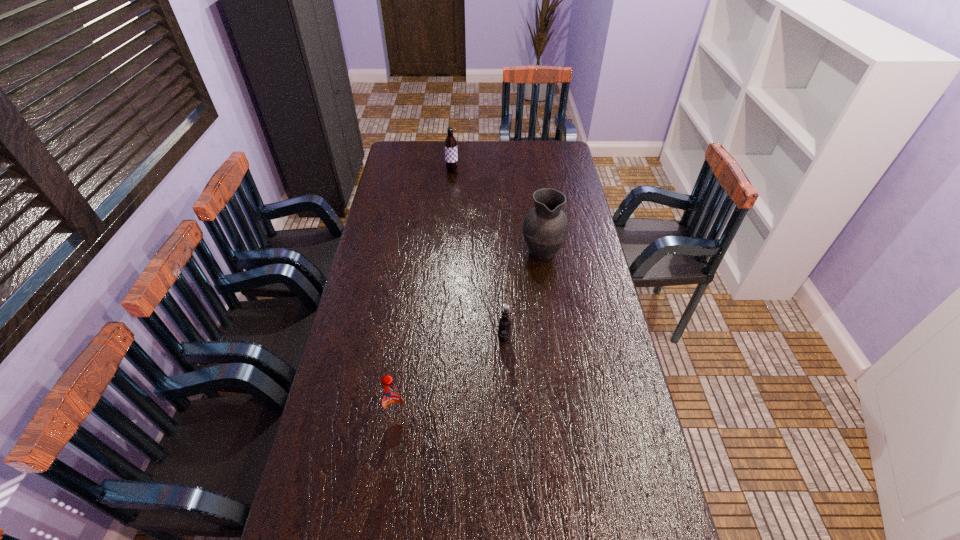
At what (x,y) coordinates should I click in order to perform the action: click on the closest root beer to the leftmost object. Please return your answer as a coordinate pair (x, y). The image size is (960, 540). Looking at the image, I should click on (504, 325).

The image size is (960, 540). What are the coordinates of `the closest root beer relative to the third object from left to right` in the screenshot? It's located at (393, 404).